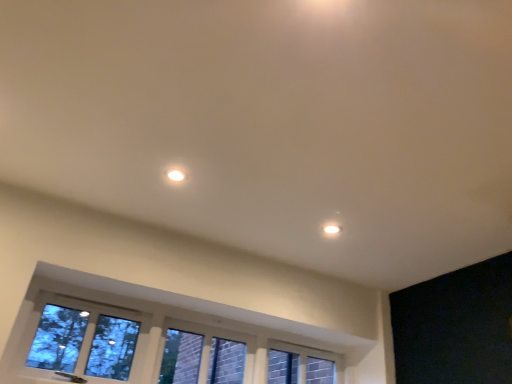
Question: Should I look upward or downward to see clear glass window at lower center?

Choices:
 (A) up
 (B) down

Answer: (B)